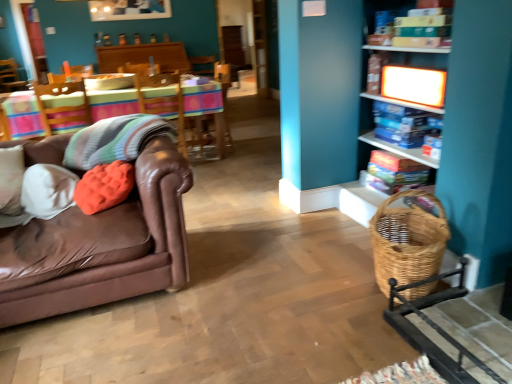
Question: Is woven brown basket at lower right at the right side of wooden shelf at right, which is the 3th shelf from top to bottom?

Choices:
 (A) yes
 (B) no

Answer: (B)

Question: Is woven brown basket at lower right not inside wooden shelf at right, which is the 3th shelf from top to bottom?

Choices:
 (A) no
 (B) yes

Answer: (B)

Question: Considering the relative sizes of woven brown basket at lower right and wooden shelf at right, which is the 3th shelf from top to bottom, in the image provided, is woven brown basket at lower right smaller than wooden shelf at right, which is the 3th shelf from top to bottom,?

Choices:
 (A) no
 (B) yes

Answer: (B)

Question: Does woven brown basket at lower right contain wooden shelf at right, positioned as the 1th shelf in bottom-to-top order?

Choices:
 (A) yes
 (B) no

Answer: (B)

Question: Considering the relative sizes of woven brown basket at lower right and wooden shelf at right, positioned as the 1th shelf in bottom-to-top order, in the image provided, is woven brown basket at lower right bigger than wooden shelf at right, positioned as the 1th shelf in bottom-to-top order,?

Choices:
 (A) no
 (B) yes

Answer: (A)

Question: From a real-world perspective, is white glossy shelf at upper right, which is the 2th shelf in top-to-bottom order, above or below knitted wool blanket at left?

Choices:
 (A) below
 (B) above

Answer: (B)

Question: Does point (437, 92) appear closer or farther from the camera than point (70, 157)?

Choices:
 (A) closer
 (B) farther

Answer: (A)

Question: Based on their positions, is white glossy shelf at upper right, the second shelf positioned from the bottom, located to the left or right of knitted wool blanket at left?

Choices:
 (A) left
 (B) right

Answer: (B)

Question: In terms of width, does white glossy shelf at upper right, which is the 2th shelf in top-to-bottom order, look wider or thinner when compared to knitted wool blanket at left?

Choices:
 (A) thin
 (B) wide

Answer: (A)

Question: Is white glossy shelf at upper right, which is the 2th shelf in top-to-bottom order, situated inside woven brown basket at lower right or outside?

Choices:
 (A) outside
 (B) inside

Answer: (A)

Question: Is white glossy shelf at upper right, the second shelf positioned from the bottom, to the left or to the right of woven brown basket at lower right in the image?

Choices:
 (A) right
 (B) left

Answer: (A)

Question: From a real-world perspective, is white glossy shelf at upper right, which is the 2th shelf in top-to-bottom order, physically located above or below woven brown basket at lower right?

Choices:
 (A) above
 (B) below

Answer: (A)

Question: From the image's perspective, is white glossy shelf at upper right, the second shelf positioned from the bottom, positioned above or below woven brown basket at lower right?

Choices:
 (A) below
 (B) above

Answer: (B)

Question: Does point (104, 157) appear closer or farther from the camera than point (204, 94)?

Choices:
 (A) farther
 (B) closer

Answer: (B)

Question: In terms of size, does knitted wool blanket at left appear bigger or smaller than wooden table at center?

Choices:
 (A) big
 (B) small

Answer: (B)